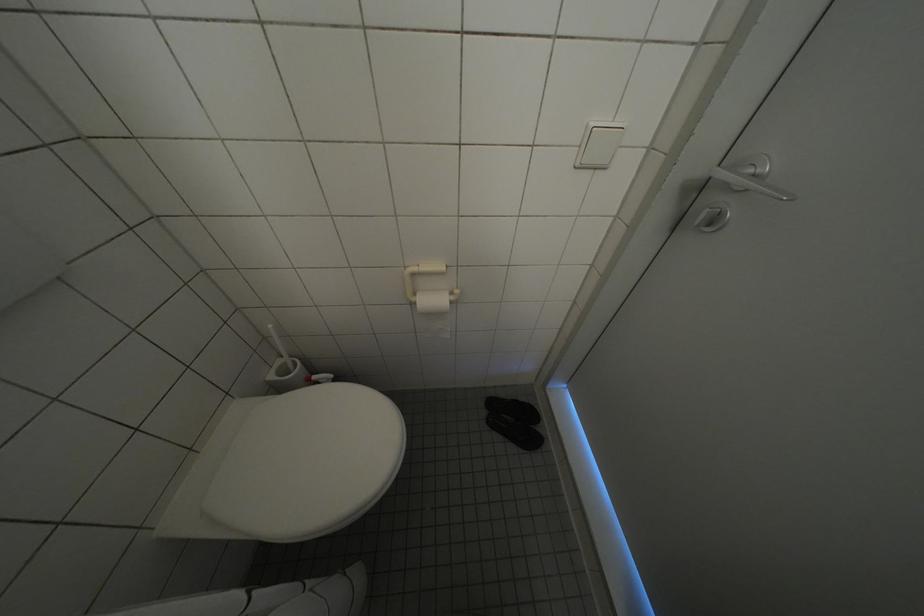
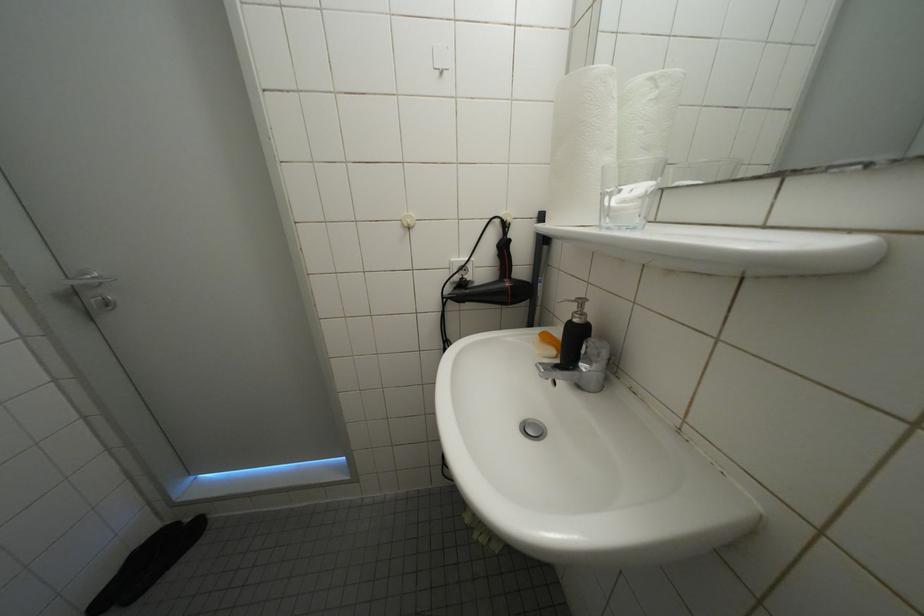
The first image is from the beginning of the video and the second image is from the end. How did the camera likely rotate when shooting the video?

The camera's rotation is toward right-down.